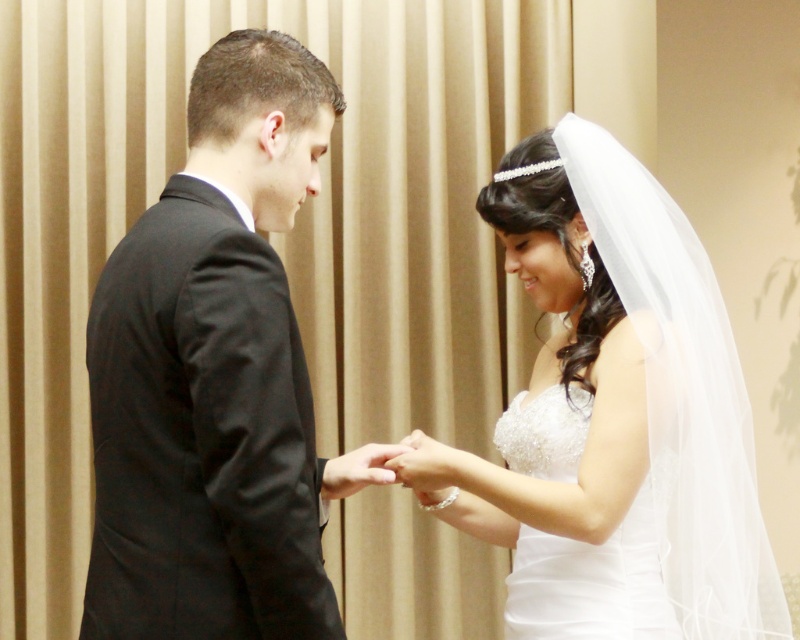
Can you confirm if black satin suit at left is thinner than white satin hand at center?

No, black satin suit at left is not thinner than white satin hand at center.

Which is behind, point (202, 433) or point (356, 484)?

Point (356, 484)

The height and width of the screenshot is (640, 800). What are the coordinates of `black satin suit at left` in the screenshot? It's located at (214, 372).

Is white satin wedding dress at center taller than white satin hand at center?

Indeed, white satin wedding dress at center has a greater height compared to white satin hand at center.

From the picture: Who is more forward, (x=558, y=548) or (x=350, y=474)?

Point (x=350, y=474)

Locate an element on the screen. The width and height of the screenshot is (800, 640). white satin wedding dress at center is located at coordinates (592, 582).

Between white satin wedding dress at center and pearl white lace hand at center, which one has more height?

Standing taller between the two is white satin wedding dress at center.

Who is higher up, white satin wedding dress at center or pearl white lace hand at center?

pearl white lace hand at center

Is point (560, 451) farther from viewer compared to point (404, 452)?

No, (560, 451) is closer to viewer.

The height and width of the screenshot is (640, 800). Find the location of `white satin wedding dress at center`. white satin wedding dress at center is located at coordinates (592, 582).